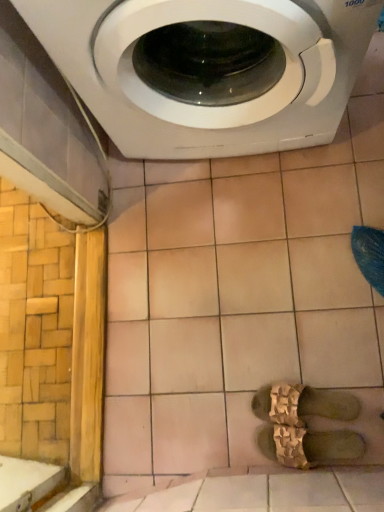
Question: Considering the relative sizes of white glossy washing machine at upper center and beige ceramic tile at upper center in the image provided, is white glossy washing machine at upper center bigger than beige ceramic tile at upper center?

Choices:
 (A) yes
 (B) no

Answer: (A)

Question: Is white glossy washing machine at upper center positioned with its back to beige ceramic tile at upper center?

Choices:
 (A) yes
 (B) no

Answer: (B)

Question: Considering the relative positions of white glossy washing machine at upper center and beige ceramic tile at upper center in the image provided, is white glossy washing machine at upper center to the left of beige ceramic tile at upper center from the viewer's perspective?

Choices:
 (A) yes
 (B) no

Answer: (A)

Question: From a real-world perspective, is white glossy washing machine at upper center under beige ceramic tile at upper center?

Choices:
 (A) no
 (B) yes

Answer: (A)

Question: From the image's perspective, is white glossy washing machine at upper center above beige ceramic tile at upper center?

Choices:
 (A) no
 (B) yes

Answer: (B)

Question: Considering the relative sizes of white glossy washing machine at upper center and beige ceramic tile at upper center in the image provided, is white glossy washing machine at upper center wider than beige ceramic tile at upper center?

Choices:
 (A) no
 (B) yes

Answer: (A)

Question: From a real-world perspective, is beige ceramic tile at upper center beneath gold textured sandals at center, the first shoe when ordered from top to bottom?

Choices:
 (A) yes
 (B) no

Answer: (A)

Question: Is beige ceramic tile at upper center behind gold textured sandals at center, which appears as the 2th shoe when ordered from the bottom?

Choices:
 (A) yes
 (B) no

Answer: (B)

Question: Would you consider beige ceramic tile at upper center to be distant from gold textured sandals at center, which appears as the 2th shoe when ordered from the bottom?

Choices:
 (A) no
 (B) yes

Answer: (A)

Question: Is beige ceramic tile at upper center wider than gold textured sandals at center, the first shoe when ordered from top to bottom?

Choices:
 (A) no
 (B) yes

Answer: (B)

Question: Is beige ceramic tile at upper center positioned beyond the bounds of gold textured sandals at center, which appears as the 2th shoe when ordered from the bottom?

Choices:
 (A) yes
 (B) no

Answer: (A)

Question: Can you confirm if beige ceramic tile at upper center is positioned to the right of gold textured sandals at center, the first shoe when ordered from top to bottom?

Choices:
 (A) yes
 (B) no

Answer: (B)

Question: Is gold textured sandals at center, the first shoe when ordered from top to bottom, not near brown textured sandals at center, acting as the first shoe starting from the bottom?

Choices:
 (A) no
 (B) yes

Answer: (A)